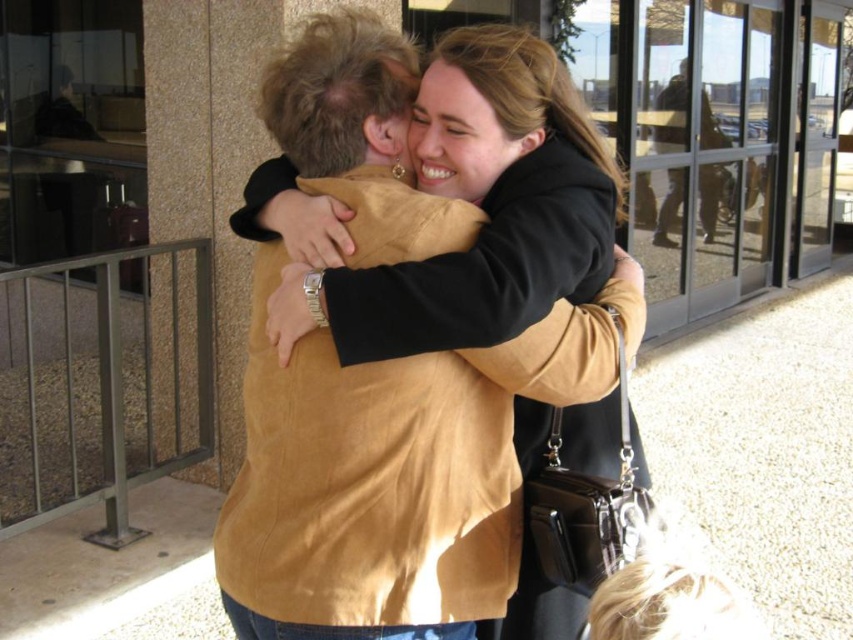
Question: Is the position of matte brown jacket at center less distant than that of brown suede jacket at upper right?

Choices:
 (A) yes
 (B) no

Answer: (A)

Question: Which point is farther to the camera?

Choices:
 (A) (705, 125)
 (B) (538, 84)

Answer: (A)

Question: Is the position of matte brown jacket at center less distant than that of brown suede jacket at upper right?

Choices:
 (A) no
 (B) yes

Answer: (B)

Question: Considering the relative positions of matte brown jacket at center and brown suede jacket at upper right in the image provided, where is matte brown jacket at center located with respect to brown suede jacket at upper right?

Choices:
 (A) above
 (B) below

Answer: (B)

Question: Among these objects, which one is farthest from the camera?

Choices:
 (A) matte brown jacket at center
 (B) brown suede jacket at upper right

Answer: (B)

Question: Among these points, which one is nearest to the camera?

Choices:
 (A) (717, 218)
 (B) (451, 186)

Answer: (B)